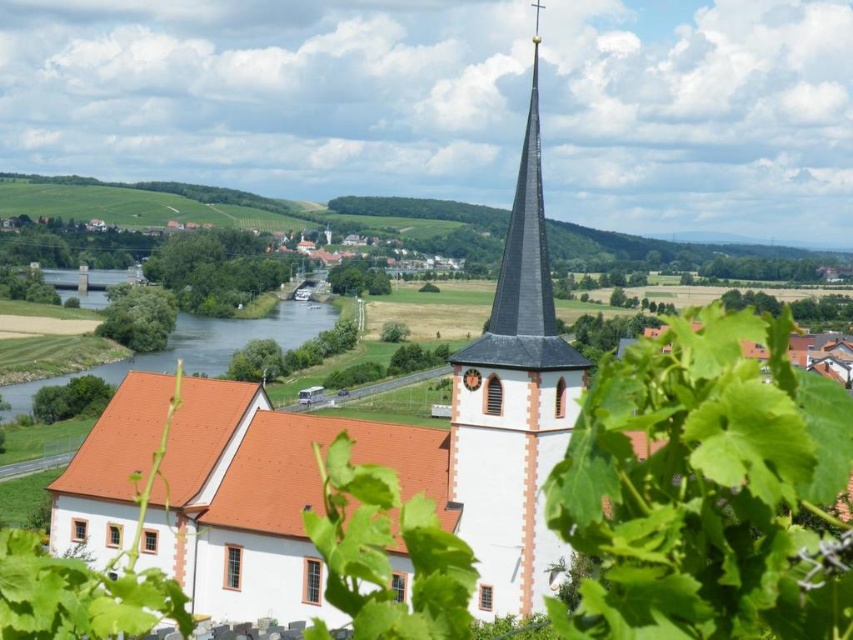
Is green grassy field at lower center bigger than blue water at lower left?

No, green grassy field at lower center is not bigger than blue water at lower left.

Does point (386, 228) come farther from viewer compared to point (323, 310)?

Yes, point (386, 228) is farther from viewer.

Between point (115, 248) and point (167, 358), which one is positioned in front?

Point (167, 358)

Image resolution: width=853 pixels, height=640 pixels. Identify the location of green grassy field at lower center. (114, 241).

Does white stucco church at center appear on the right side of blue water at lower left?

Correct, you'll find white stucco church at center to the right of blue water at lower left.

Is white stucco church at center in front of blue water at lower left?

Yes.

Between point (517, 586) and point (164, 365), which one is positioned behind?

Positioned behind is point (164, 365).

Identify the location of white stucco church at center. This screenshot has height=640, width=853. (511, 412).

Is point (509, 525) positioned in front of point (264, 250)?

Yes.

Looking at this image, who is more distant from viewer, (527, 177) or (347, 243)?

Point (347, 243)

Is point (532, 90) closer to viewer compared to point (364, 228)?

That is True.

You are a GUI agent. You are given a task and a screenshot of the screen. Output one action in this format:
    pyautogui.click(x=<x>, y=<y>)
    Task: Click on the white smooth steeple at center
    
    Given the screenshot: What is the action you would take?
    pyautogui.click(x=514, y=406)